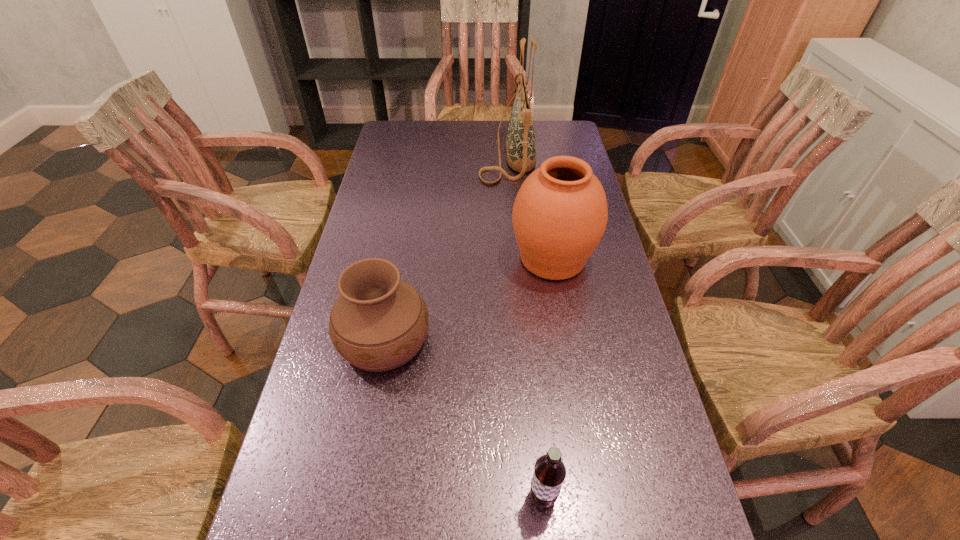
At what (x,y) coordinates should I click in order to perform the action: click on the farthest object. Please return your answer as a coordinate pair (x, y). The width and height of the screenshot is (960, 540). Looking at the image, I should click on (520, 143).

In order to click on handbag in this screenshot , I will do `click(520, 143)`.

Image resolution: width=960 pixels, height=540 pixels. Find the location of `the farther urn`. the farther urn is located at coordinates (560, 213).

This screenshot has width=960, height=540. What are the coordinates of `the second farthest object` in the screenshot? It's located at (560, 213).

Find the location of `the left urn`. the left urn is located at coordinates (379, 322).

The width and height of the screenshot is (960, 540). What are the coordinates of `the shorter urn` in the screenshot? It's located at (379, 322).

The height and width of the screenshot is (540, 960). I want to click on the nearest object, so click(549, 473).

Where is `free spot located on the front-facing side of the tallest object`? free spot located on the front-facing side of the tallest object is located at coordinates (407, 153).

The width and height of the screenshot is (960, 540). Identify the location of free space located on the front-facing side of the tallest object. (454, 153).

Find the location of `blank space located on the front-facing side of the tallest object`. blank space located on the front-facing side of the tallest object is located at coordinates (444, 153).